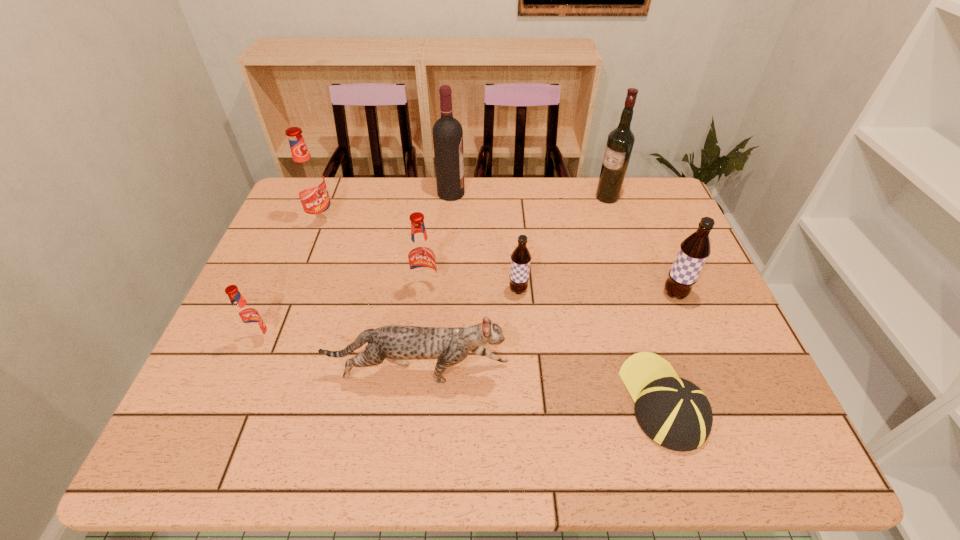
This screenshot has height=540, width=960. I want to click on the fourth root beer from left to right, so click(x=520, y=258).

Where is `the left brown root beer`? This screenshot has height=540, width=960. the left brown root beer is located at coordinates (520, 258).

Locate an element on the screen. This screenshot has width=960, height=540. cat is located at coordinates (449, 345).

Where is `the shortest object`? the shortest object is located at coordinates (673, 412).

The image size is (960, 540). What are the coordinates of `black baseball cap` in the screenshot? It's located at (673, 412).

This screenshot has height=540, width=960. I want to click on free region located on the label of the left wine bottle, so click(539, 193).

The width and height of the screenshot is (960, 540). I want to click on vacant space situated 0.270m on the front and back of the right wine bottle, so click(512, 197).

Locate an element on the screen. The image size is (960, 540). free space located on the front and back of the right wine bottle is located at coordinates (577, 197).

Locate an element on the screen. vacant region located on the front and back of the right wine bottle is located at coordinates (471, 197).

Find the location of a particular element. Image resolution: width=960 pixels, height=540 pixels. vacant region located on the front of the farthest root beer is located at coordinates (296, 287).